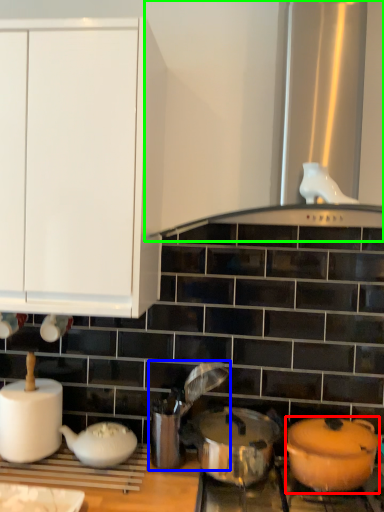
Question: Based on their relative distances, which object is farther from kitchen appliance (highlighted by a red box)? Choose from appliance (highlighted by a blue box) and vent (highlighted by a green box).

Choices:
 (A) appliance
 (B) vent

Answer: (B)